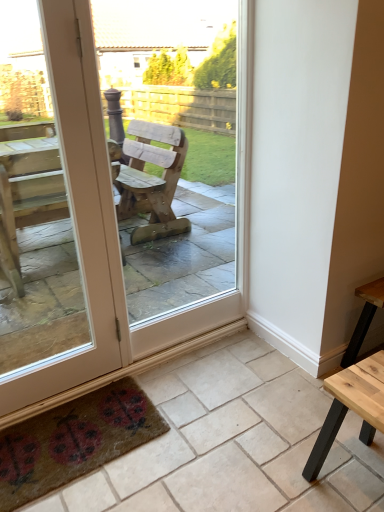
Question: From the image's perspective, is textured brown mat with ladybugs at lower left below brown textured mat at lower left?

Choices:
 (A) yes
 (B) no

Answer: (A)

Question: Can you confirm if textured brown mat with ladybugs at lower left is smaller than brown textured mat at lower left?

Choices:
 (A) yes
 (B) no

Answer: (A)

Question: From a real-world perspective, is textured brown mat with ladybugs at lower left located higher than brown textured mat at lower left?

Choices:
 (A) no
 (B) yes

Answer: (B)

Question: Is textured brown mat with ladybugs at lower left at the right side of brown textured mat at lower left?

Choices:
 (A) no
 (B) yes

Answer: (A)

Question: Can you confirm if textured brown mat with ladybugs at lower left is wider than brown textured mat at lower left?

Choices:
 (A) no
 (B) yes

Answer: (A)

Question: Is textured brown mat with ladybugs at lower left not inside brown textured mat at lower left?

Choices:
 (A) no
 (B) yes

Answer: (A)

Question: Does brown textured mat at lower left have a lesser width compared to textured brown mat with ladybugs at lower left?

Choices:
 (A) yes
 (B) no

Answer: (B)

Question: Considering the relative positions of brown textured mat at lower left and textured brown mat with ladybugs at lower left in the image provided, is brown textured mat at lower left to the left of textured brown mat with ladybugs at lower left from the viewer's perspective?

Choices:
 (A) no
 (B) yes

Answer: (A)

Question: Could you tell me if brown textured mat at lower left is turned towards textured brown mat with ladybugs at lower left?

Choices:
 (A) yes
 (B) no

Answer: (B)

Question: Is brown textured mat at lower left far away from textured brown mat with ladybugs at lower left?

Choices:
 (A) no
 (B) yes

Answer: (A)

Question: Would you say brown textured mat at lower left contains textured brown mat with ladybugs at lower left?

Choices:
 (A) no
 (B) yes

Answer: (B)

Question: From the image's perspective, is brown textured mat at lower left beneath textured brown mat with ladybugs at lower left?

Choices:
 (A) yes
 (B) no

Answer: (B)

Question: Is wooden chair at center closer to the viewer compared to light brown wooden table at lower right?

Choices:
 (A) no
 (B) yes

Answer: (A)